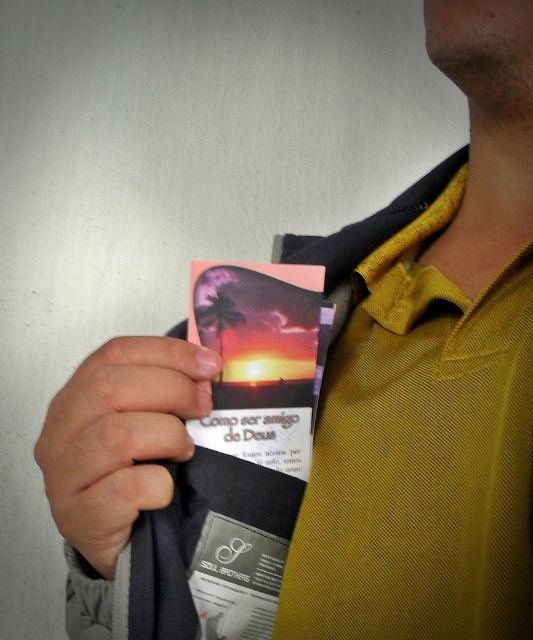
You are a photographer trying to capture the matte plastic card at center in a close shot. The smooth skin hand at lower left is blocking part of the card. Can you adjust your angle to avoid the hand?

The smooth skin hand at lower left is positioned under the matte plastic card at center, so tilting the camera slightly downward might allow you to capture the matte plastic card at center without the hand obstructing it.

You are a photographer trying to capture the booklet in the image. To ensure the smooth skin hand at lower left is not blocking the booklet, where should you position your camera relative to the hand?

The smooth skin hand at lower left is located at coordinates 0.684 on the x axis and 0.225 on the y axis. To avoid blocking the booklet, position the camera such that it captures the booklet while avoiding the area around those coordinates.